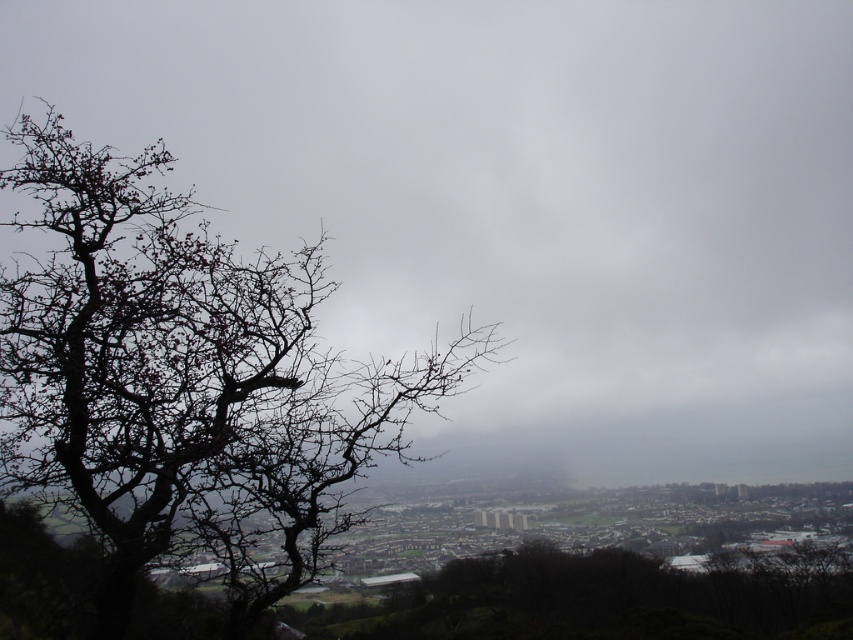
Is gray cloudy sky at upper center bigger than bare branches at left?

Correct, gray cloudy sky at upper center is larger in size than bare branches at left.

Can you confirm if gray cloudy sky at upper center is thinner than bare branches at left?

Incorrect, gray cloudy sky at upper center's width is not less than bare branches at left's.

Who is more distant from viewer, (805, 440) or (317, 404)?

Positioned behind is point (805, 440).

The image size is (853, 640). In order to click on gray cloudy sky at upper center in this screenshot , I will do `click(521, 200)`.